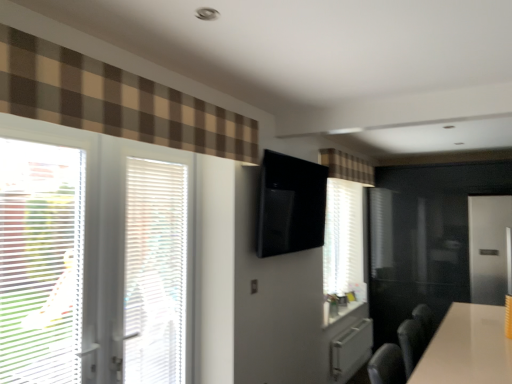
Question: Considering the positions of white plastic blinds at left and white plastic blinds at left, which appears as the first window when viewed from the left, in the image, is white plastic blinds at left wider or thinner than white plastic blinds at left, which appears as the first window when viewed from the left,?

Choices:
 (A) thin
 (B) wide

Answer: (A)

Question: From the image's perspective, is white plastic blinds at left above or below white plastic blinds at left, marked as the second window in a right-to-left arrangement?

Choices:
 (A) above
 (B) below

Answer: (B)

Question: Estimate the real-world distances between objects in this image. Which object is farther from the brown plaid curtain at upper center, which ranks as the 1th curtain in back-to-front order?

Choices:
 (A) white plastic blinds at left, marked as the second window in a right-to-left arrangement
 (B) white textured blinds at left, which is counted as the second window, starting from the left
 (C) brown checkered curtain at upper left, which is the 1th curtain in front-to-back order
 (D) white plastic blinds at left
 (E) satin silver screen door at right

Answer: (A)

Question: Which of these objects is positioned farthest from the brown plaid curtain at upper center, the first curtain positioned from the right?

Choices:
 (A) white textured blinds at left, acting as the first window starting from the right
 (B) satin silver screen door at right
 (C) white plastic blinds at left, which appears as the first window when viewed from the left
 (D) white plastic blinds at left
 (E) brown checkered curtain at upper left, which is the second curtain from right to left

Answer: (C)